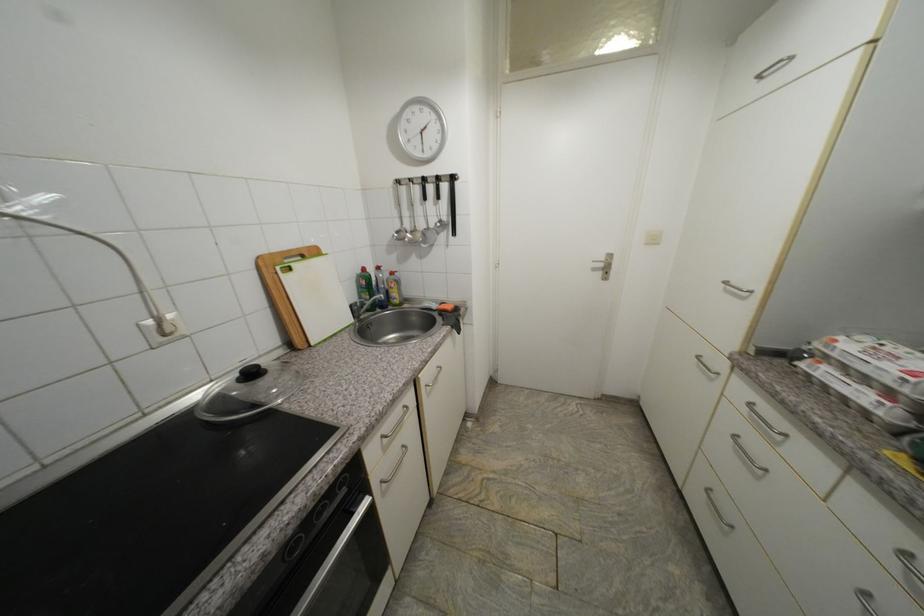
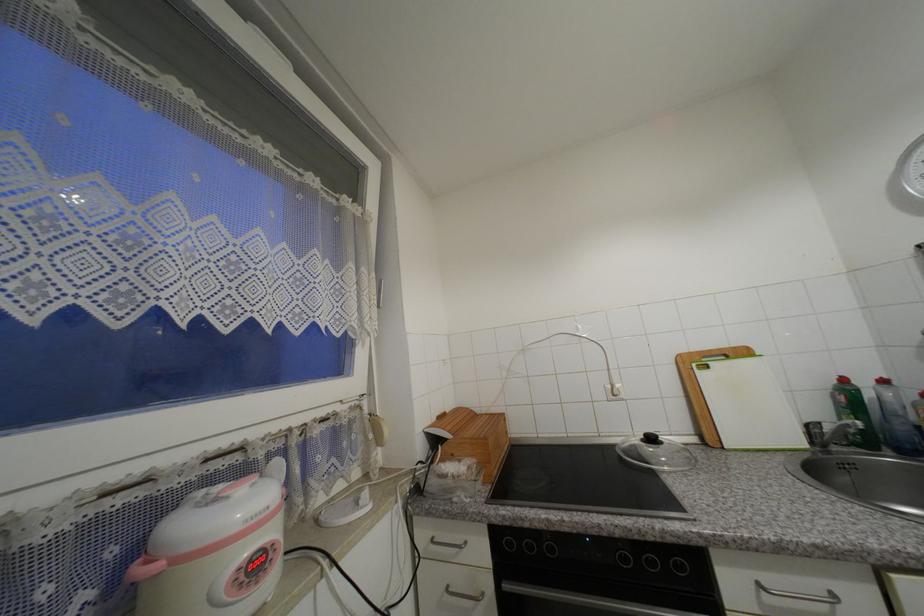
Locate, in the second image, the point that corresponds to (321,253) in the first image.

(749, 354)